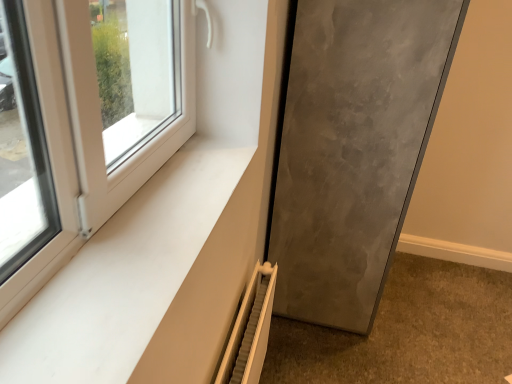
Question: From a real-world perspective, does white matte window sill at lower left stand above matte gray door at lower right?

Choices:
 (A) yes
 (B) no

Answer: (A)

Question: Could you tell me if white matte window sill at lower left is turned towards matte gray door at lower right?

Choices:
 (A) yes
 (B) no

Answer: (B)

Question: Is white matte window sill at lower left smaller than matte gray door at lower right?

Choices:
 (A) no
 (B) yes

Answer: (B)

Question: Are white matte window sill at lower left and matte gray door at lower right beside each other?

Choices:
 (A) no
 (B) yes

Answer: (A)

Question: Does white matte window sill at lower left appear on the right side of matte gray door at lower right?

Choices:
 (A) no
 (B) yes

Answer: (A)

Question: Is white matte window sill at lower left not within matte gray door at lower right?

Choices:
 (A) yes
 (B) no

Answer: (A)

Question: Does white matte window sill at lower left have a greater height compared to white textured radiator at lower center?

Choices:
 (A) no
 (B) yes

Answer: (A)

Question: Is white matte window sill at lower left at the left side of white textured radiator at lower center?

Choices:
 (A) yes
 (B) no

Answer: (A)

Question: From the image's perspective, is white matte window sill at lower left under white textured radiator at lower center?

Choices:
 (A) yes
 (B) no

Answer: (B)

Question: Does white matte window sill at lower left turn towards white textured radiator at lower center?

Choices:
 (A) no
 (B) yes

Answer: (A)

Question: Would you say white matte window sill at lower left is outside white textured radiator at lower center?

Choices:
 (A) yes
 (B) no

Answer: (A)

Question: From the image's perspective, is white matte window sill at lower left over white textured radiator at lower center?

Choices:
 (A) no
 (B) yes

Answer: (B)

Question: Is white textured radiator at lower center inside matte gray door at lower right?

Choices:
 (A) yes
 (B) no

Answer: (B)